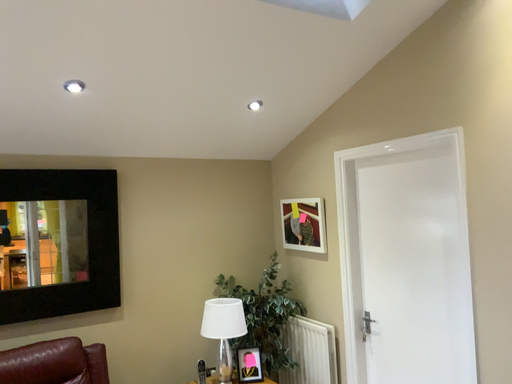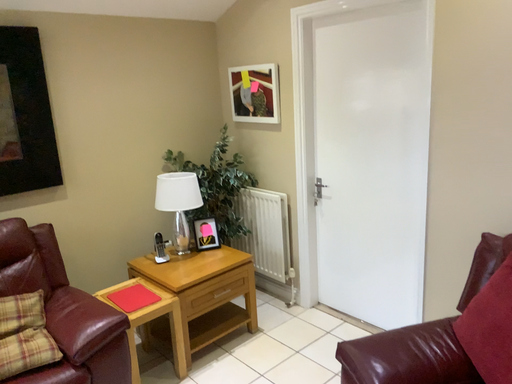
Question: Which way did the camera rotate in the video?

Choices:
 (A) rotated right
 (B) rotated left

Answer: (A)